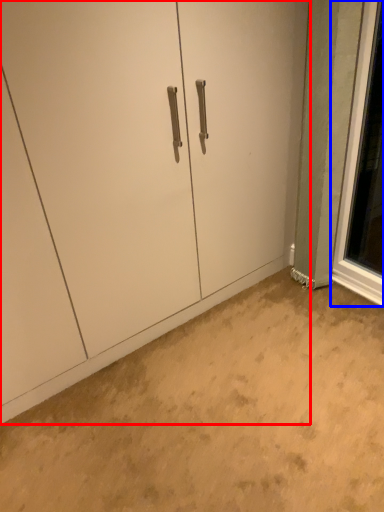
Question: Which point is further to the camera, door (highlighted by a red box) or window (highlighted by a blue box)?

Choices:
 (A) door
 (B) window

Answer: (B)